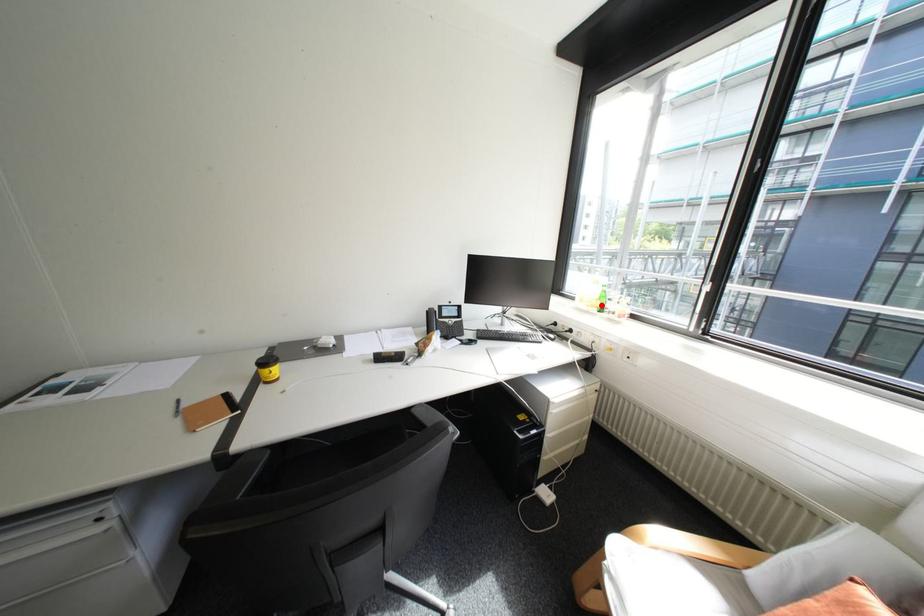
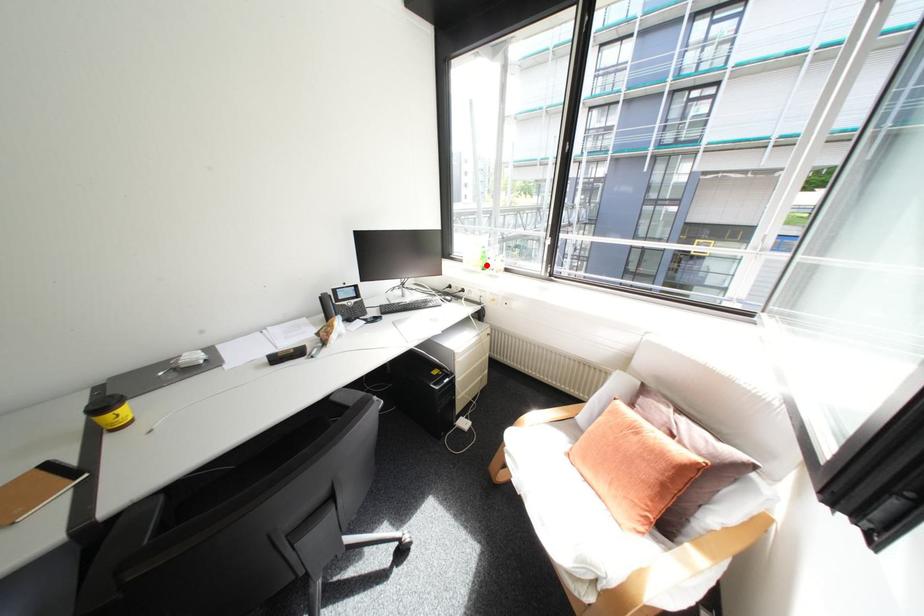
I am providing you with two images of the same scene from different viewpoints. A red point is marked on the first image and another point is marked on the second image. Do the highlighted points in image1 and image2 indicate the same real-world spot?

Yes